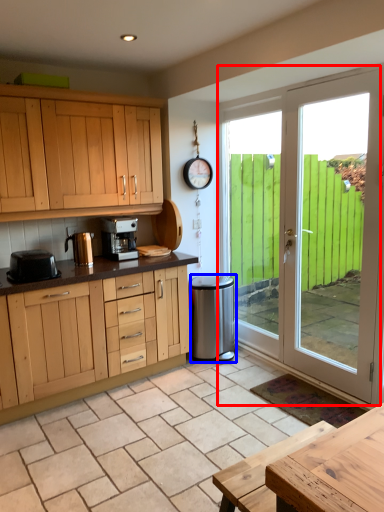
Question: Which point is closer to the camera, door (highlighted by a red box) or appliance (highlighted by a blue box)?

Choices:
 (A) door
 (B) appliance

Answer: (A)